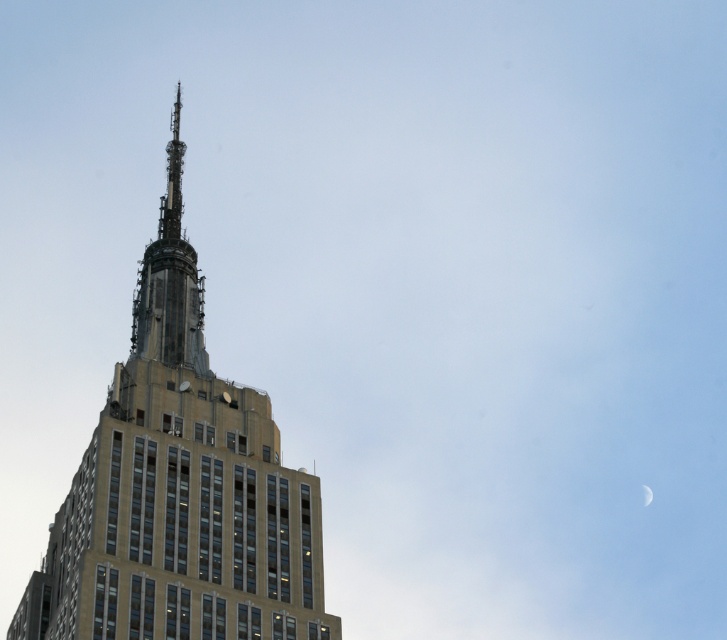
Which is below, beige stone tower at center or silvery metallic crescent at upper right?

silvery metallic crescent at upper right

Which of these two, beige stone tower at center or silvery metallic crescent at upper right, stands shorter?

Standing shorter between the two is silvery metallic crescent at upper right.

Between point (236, 486) and point (646, 502), which one is positioned in front?

Point (236, 486)

Identify the location of beige stone tower at center. This screenshot has height=640, width=727. (180, 488).

Can you confirm if dark gray metallic spire at center is positioned above silvery metallic crescent at upper right?

Indeed, dark gray metallic spire at center is positioned over silvery metallic crescent at upper right.

Who is taller, dark gray metallic spire at center or silvery metallic crescent at upper right?

With more height is dark gray metallic spire at center.

Who is more forward, (172, 332) or (646, 486)?

Point (172, 332)

Find the location of a particular element. dark gray metallic spire at center is located at coordinates (169, 278).

Which is above, beige stone tower at center or dark gray metallic spire at center?

dark gray metallic spire at center is above.

Who is more distant from viewer, (209,497) or (140,326)?

Positioned behind is point (140,326).

Does point (105, 604) come behind point (174, 307)?

No, (105, 604) is in front of (174, 307).

What are the coordinates of `beige stone tower at center` in the screenshot? It's located at (180, 488).